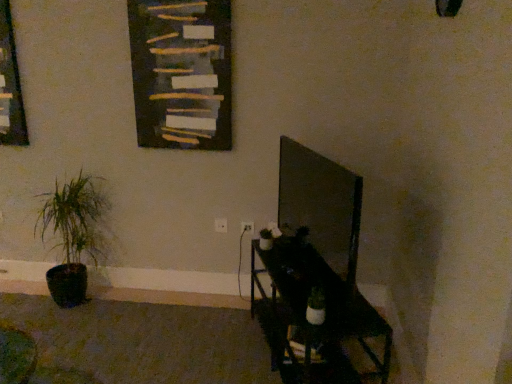
The width and height of the screenshot is (512, 384). Find the location of `free point below dark wood bulletin board at upper center (from a real-world perspective)`. free point below dark wood bulletin board at upper center (from a real-world perspective) is located at coordinates (189, 291).